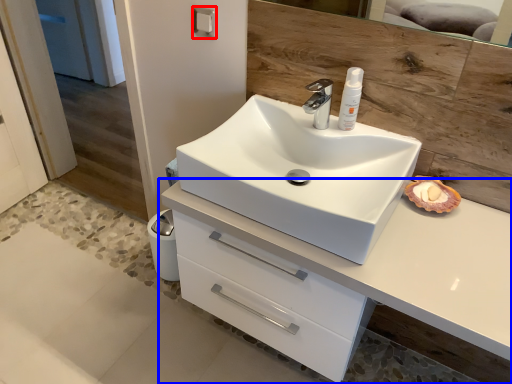
Question: Which of the following is the closest to the observer, towel bar (highlighted by a red box) or bathroom cabinet (highlighted by a blue box)?

Choices:
 (A) towel bar
 (B) bathroom cabinet

Answer: (B)